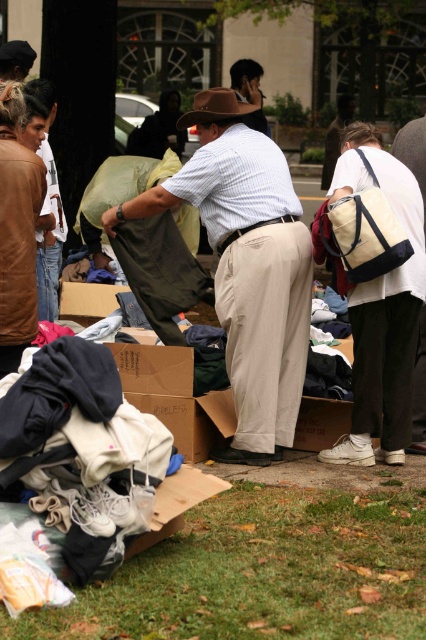
Between point (259, 300) and point (262, 120), which one is positioned in front?

Positioned in front is point (259, 300).

From the picture: How far apart are khaki cotton pants at center and matte brown hat at center?

7.96 meters

The height and width of the screenshot is (640, 426). What are the coordinates of `khaki cotton pants at center` in the screenshot? It's located at (253, 275).

In order to click on khaki cotton pants at center in this screenshot , I will do `click(253, 275)`.

Is green grass at lower center in front of matte brown hat at center?

Yes, green grass at lower center is closer to the viewer.

Can you confirm if green grass at lower center is thinner than matte brown hat at center?

No.

I want to click on green grass at lower center, so click(262, 573).

Who is higher up, brown leather jacket at left or white canvas backpack at right?

brown leather jacket at left is above.

The height and width of the screenshot is (640, 426). Describe the element at coordinates (17, 248) in the screenshot. I see `brown leather jacket at left` at that location.

Identify the location of brown leather jacket at left. (17, 248).